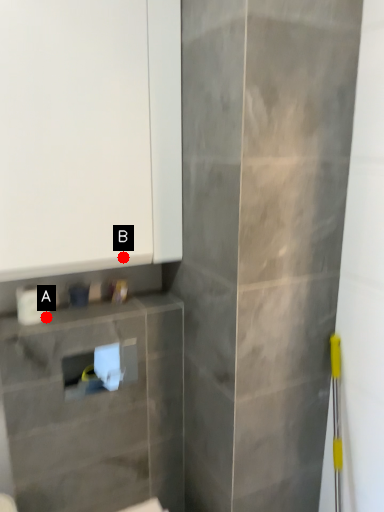
Question: Two points are circled on the image, labeled by A and B beside each circle. Which point appears closest to the camera in this image?

Choices:
 (A) A is closer
 (B) B is closer

Answer: (B)